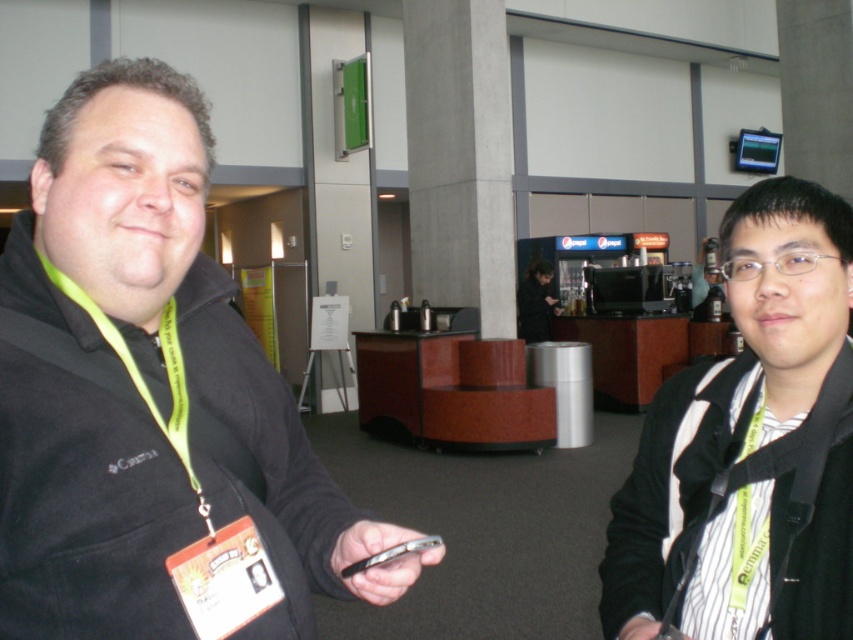
Question: Which point is closer to the camera?

Choices:
 (A) black fleece jacket at center
 (B) green fabric lanyard at left
 (C) black matte jacket at center

Answer: (A)

Question: Is black fleece jacket at center bigger than green fabric lanyard at left?

Choices:
 (A) no
 (B) yes

Answer: (B)

Question: Among these points, which one is farthest from the camera?

Choices:
 (A) (33, 362)
 (B) (202, 520)
 (C) (717, 486)

Answer: (C)

Question: Which object appears farthest from the camera in this image?

Choices:
 (A) green fabric lanyard at left
 (B) black fleece jacket at center
 (C) black matte jacket at center

Answer: (C)

Question: Can you confirm if black matte jacket at center is smaller than green fabric lanyard at left?

Choices:
 (A) yes
 (B) no

Answer: (B)

Question: Can you confirm if black fleece jacket at center is smaller than black matte jacket at center?

Choices:
 (A) no
 (B) yes

Answer: (A)